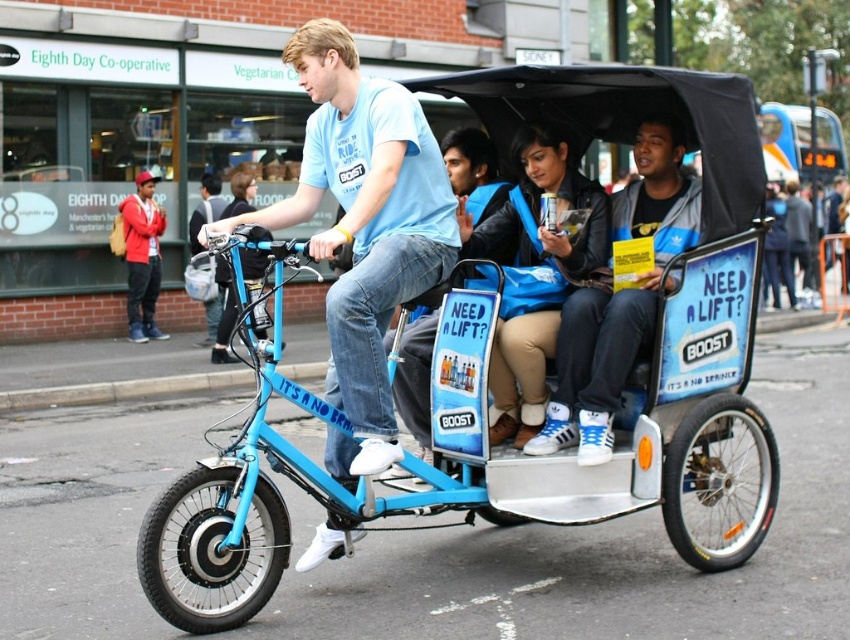
Does blue matte tricycle at center have a larger size compared to matte blue bicycle at center?

Yes.

Does blue matte tricycle at center appear over matte blue bicycle at center?

Actually, blue matte tricycle at center is below matte blue bicycle at center.

This screenshot has height=640, width=850. I want to click on blue matte tricycle at center, so click(484, 380).

Locate an element on the screen. The width and height of the screenshot is (850, 640). blue matte tricycle at center is located at coordinates (484, 380).

Can you confirm if matte blue bicycle at center is positioned below blue leather jacket at center?

Indeed, matte blue bicycle at center is positioned under blue leather jacket at center.

Which of these two, matte blue bicycle at center or blue leather jacket at center, stands taller?

matte blue bicycle at center

Between point (349, 122) and point (624, 342), which one is positioned behind?

Positioned behind is point (624, 342).

Locate an element on the screen. Image resolution: width=850 pixels, height=640 pixels. matte blue bicycle at center is located at coordinates (363, 228).

Identify the location of blue matte tricycle at center. (484, 380).

Which is in front, point (463, 364) or point (578, 291)?

Positioned in front is point (463, 364).

What do you see at coordinates (484, 380) in the screenshot?
I see `blue matte tricycle at center` at bounding box center [484, 380].

Identify the location of blue matte tricycle at center. (484, 380).